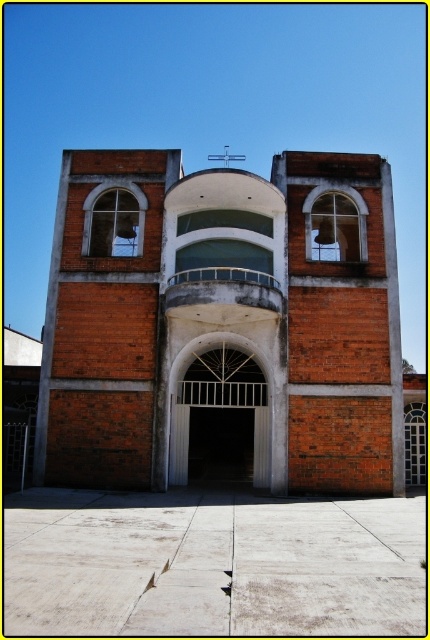
Does brick building at center appear over white metal gate at center?

Correct, brick building at center is located above white metal gate at center.

From the picture: Which of these two, brick building at center or white metal gate at center, stands shorter?

With less height is white metal gate at center.

Locate an element on the screen. Image resolution: width=430 pixels, height=640 pixels. brick building at center is located at coordinates (223, 320).

Locate an element on the screen. The width and height of the screenshot is (430, 640). brick building at center is located at coordinates (223, 320).